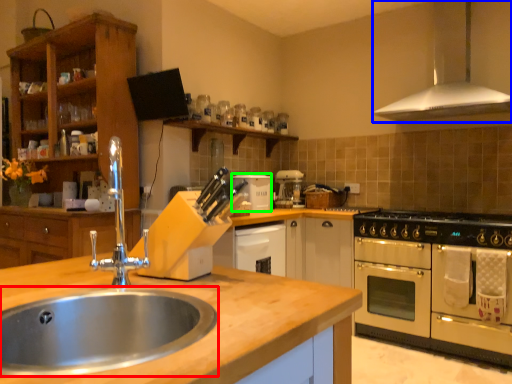
Question: Which is nearer to the sink (highlighted by a red box)? exhaust hood (highlighted by a blue box) or appliance (highlighted by a green box).

Choices:
 (A) exhaust hood
 (B) appliance

Answer: (B)